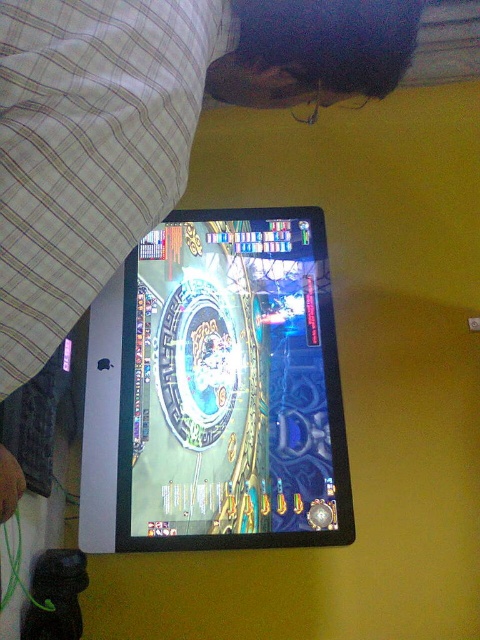
You are trying to place a new sticker on your tablet. You have two tablets in front of you, a matte black tablet at center and a glossy plastic tablet at center. Which tablet should you choose if you want the sticker to stick better?

The glossy plastic tablet at center would be better for sticking the sticker since glossy surfaces generally provide a smoother and more even surface for adhesives to adhere to compared to matte surfaces.

You are holding a matte black tablet at center and want to place it on the arcade game machine in the foreground. The tablet is 12 inches long. Can you fit it horizontally on the screen of the arcade game machine?

The distance between the matte black tablet at center and the arcade game machine is 16.84 inches. Since the tablet is 12 inches long, it can fit horizontally on the screen as the available space is larger than the tablet.

You are standing in front of the arcade game machine. You want to place your two tablets, the matte black tablet at center and the glossy plastic tablet at center, on the table next to the machine. Which tablet should you place on the left side of the table to match their current positions?

The matte black tablet at center should be placed on the left side of the table because it is currently positioned to the left of the glossy plastic tablet at center.